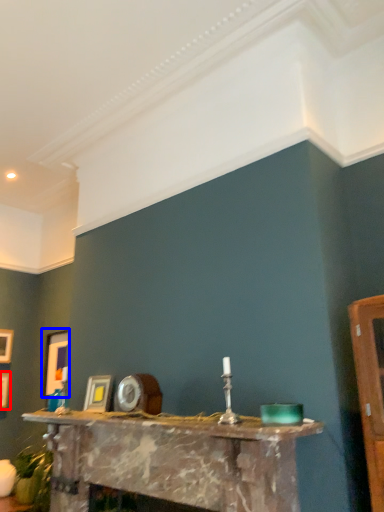
Question: Among these objects, which one is farthest to the camera, picture frame (highlighted by a red box) or picture frame (highlighted by a blue box)?

Choices:
 (A) picture frame
 (B) picture frame

Answer: (A)